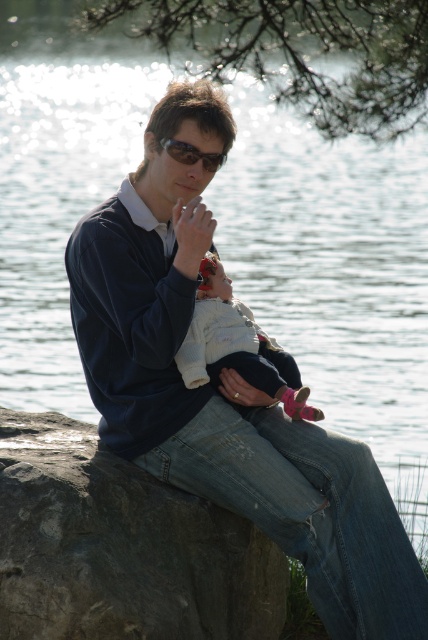
Between dark blue denim jacket at center and sunglasses at center, which one appears on the right side from the viewer's perspective?

dark blue denim jacket at center

Between dark blue denim jacket at center and sunglasses at center, which one has more height?

With more height is dark blue denim jacket at center.

Is point (211, 493) more distant than point (166, 152)?

No, it is not.

Identify the location of dark blue denim jacket at center. The height and width of the screenshot is (640, 428). (225, 392).

Measure the distance between rough gray rock at lower left and white soft baby at center.

rough gray rock at lower left is 25.82 inches away from white soft baby at center.

Can you confirm if rough gray rock at lower left is positioned to the left of white soft baby at center?

Indeed, rough gray rock at lower left is positioned on the left side of white soft baby at center.

Locate an element on the screen. Image resolution: width=428 pixels, height=640 pixels. rough gray rock at lower left is located at coordinates (121, 547).

Who is lower down, dark blue denim jacket at center or rough gray rock at lower left?

rough gray rock at lower left is below.

Between point (407, 577) and point (282, 554), which one is positioned in front?

Point (407, 577) is more forward.

Does point (181, 177) lie in front of point (128, 474)?

No, it is behind (128, 474).

I want to click on dark blue denim jacket at center, so tap(225, 392).